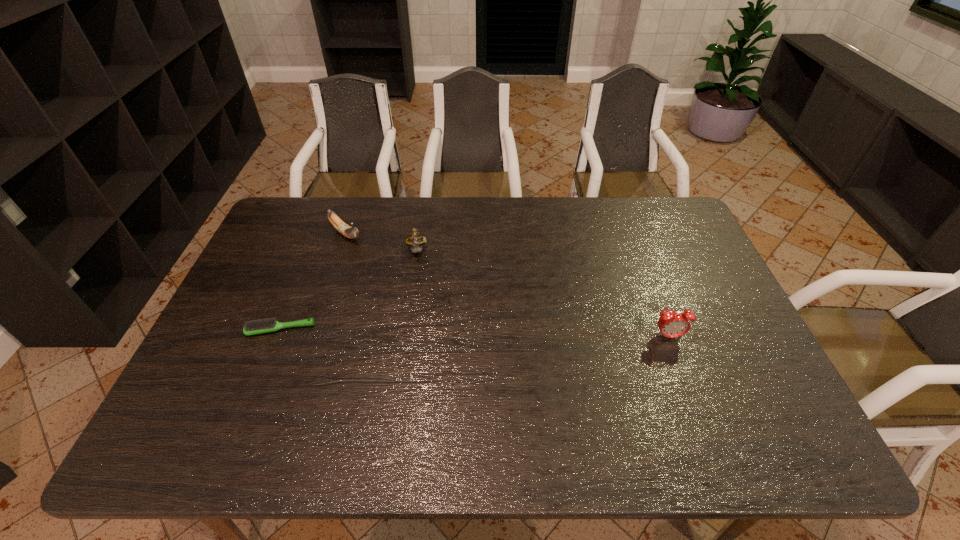
You are a GUI agent. You are given a task and a screenshot of the screen. Output one action in this format:
    pyautogui.click(x=<x>, y=<y>)
    Task: Click on the free space at the far right corner
    The height and width of the screenshot is (540, 960).
    Given the screenshot: What is the action you would take?
    pyautogui.click(x=660, y=238)

Identify the location of free space at the near right corner. (745, 386).

Locate an element on the screen. vacant region between the alarm clock and the banana is located at coordinates (507, 285).

Find the location of a particular element. This screenshot has width=960, height=540. free point between the hairbrush and the second shortest object is located at coordinates (313, 281).

Identify the location of free space between the rightmost object and the shortest object. (474, 333).

Locate an element on the screen. Image resolution: width=960 pixels, height=540 pixels. free spot between the second object from right to left and the hairbrush is located at coordinates (348, 291).

At what (x,y) coordinates should I click in order to perform the action: click on unoccupied position between the alarm clock and the third object from left to right. Please return your answer as a coordinate pair (x, y). Looking at the image, I should click on (542, 294).

Locate an element on the screen. The height and width of the screenshot is (540, 960). vacant space that is in between the hairbrush and the third tallest object is located at coordinates (313, 281).

Image resolution: width=960 pixels, height=540 pixels. Find the location of `vacant space that is in between the snail and the third tallest object`. vacant space that is in between the snail and the third tallest object is located at coordinates (381, 243).

You are a GUI agent. You are given a task and a screenshot of the screen. Output one action in this format:
    pyautogui.click(x=<x>, y=<y>)
    Task: Click on the vacant area that lies between the rightmost object and the shortest object
    
    Given the screenshot: What is the action you would take?
    pyautogui.click(x=474, y=333)